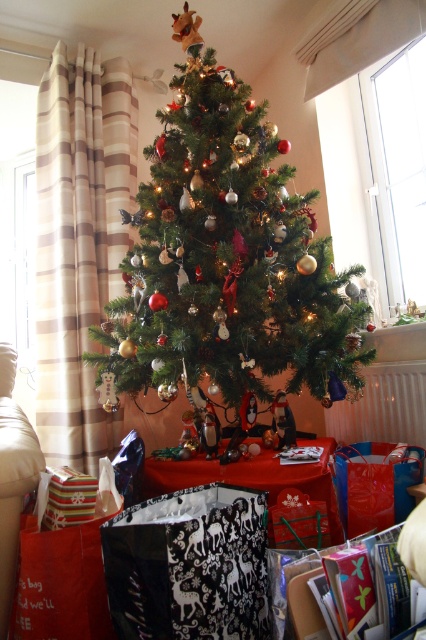
You are a guest at a Christmas party and want to place a new decoration on the table. The decoration is exactly the same size as the striped paper gift at lower left. Will it fit on the table without overlapping the green natural christmas tree at center?

The green natural christmas tree at center is wider than the striped paper gift at lower left. Since the decoration is the same size as the striped paper gift at lower left, it should fit on the table without overlapping the tree as long as there is enough space. However, the exact placement depends on the table dimensions not specified here.

From the picture: You are standing in the room where the green natural christmas tree at center is displayed. You want to take a photo of the tree from where you are standing. If your camera has a focal length of 50mm and you want the tree to fill the frame, would you need to zoom in or out?

The green natural christmas tree at center is 1.57 meters from camera. To fill the frame with the tree at this distance, you would need to zoom in to a focal length greater than 50mm. Since the current focal length is 50mm, you need to zoom in to achieve the desired framing.

You are a guest at a Christmas party and want to find the tallest object in the room. Which one is taller between the green natural christmas tree at center and the striped paper gift at lower left?

The green natural christmas tree at center is taller than the striped paper gift at lower left.